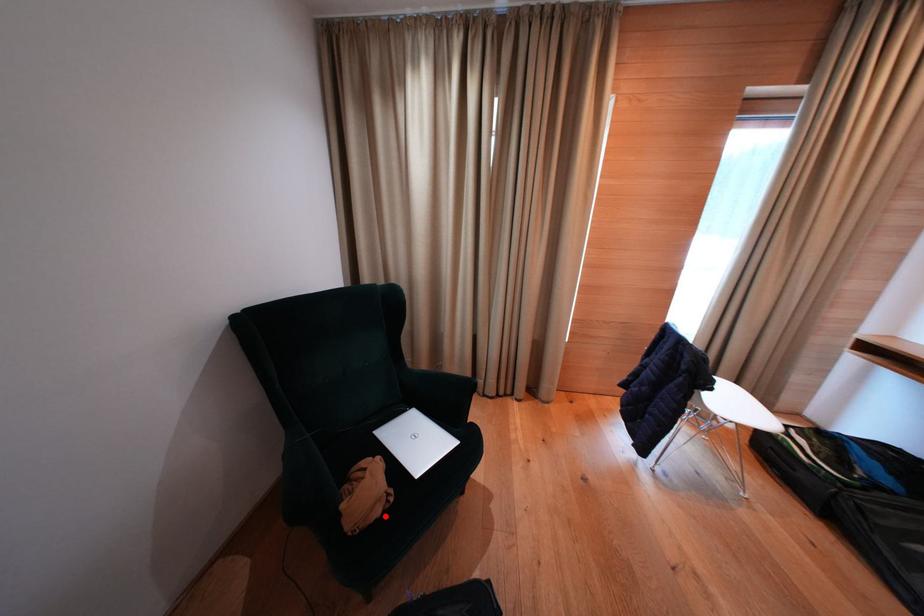
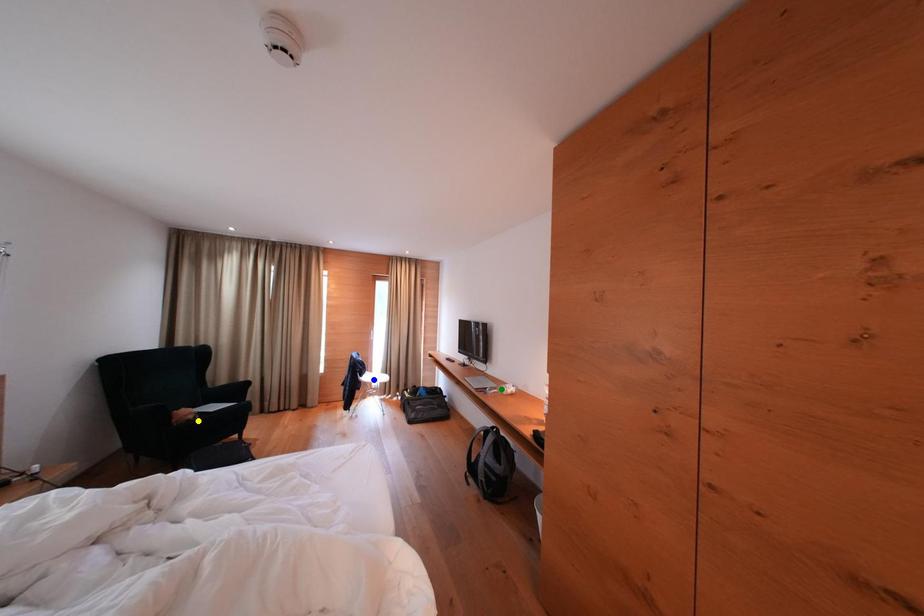
Question: I am providing you with two images of the same scene from different viewpoints. A red point is marked on the first image. You are given multiple points on the second image. Which mark in image 2 goes with the point in image 1?

Choices:
 (A) blue point
 (B) yellow point
 (C) green point

Answer: (B)